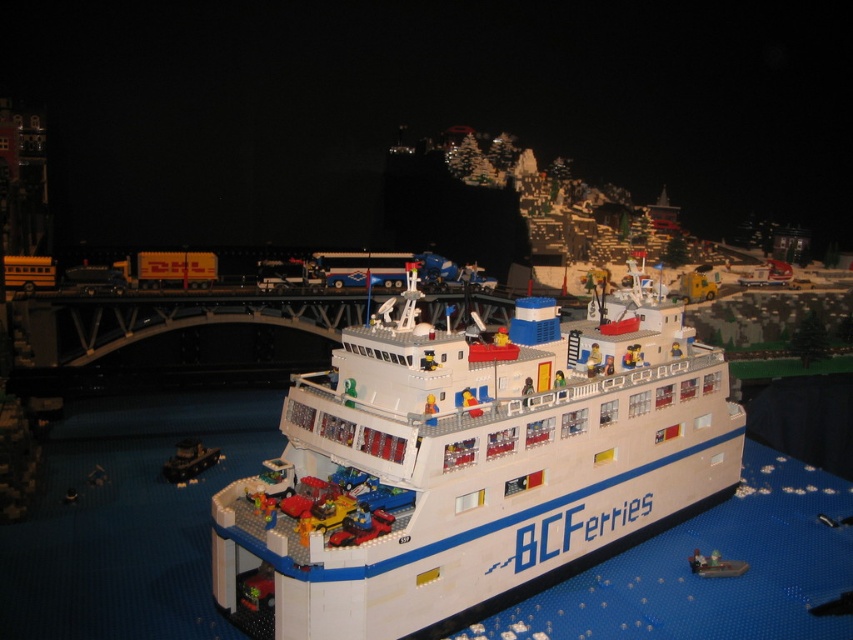
You are a passenger on the ferry and want to know which vessel is bigger between the white plastic cruise ship at center and the smooth black boat at lower left. Can you tell me?

The white plastic cruise ship at center is larger in size than the smooth black boat at lower left according to the description.

You are a passenger on the ferry and want to take a photo of the smooth black boat at lower left and the white plastic boat at center from the upper deck. Which boat should you focus on first if you want to capture both in the same frame without moving your camera?

The white plastic boat at center is behind the smooth black boat at lower left, so you should focus on the smooth black boat at lower left first to ensure it is in front and both can be captured in the same frame.